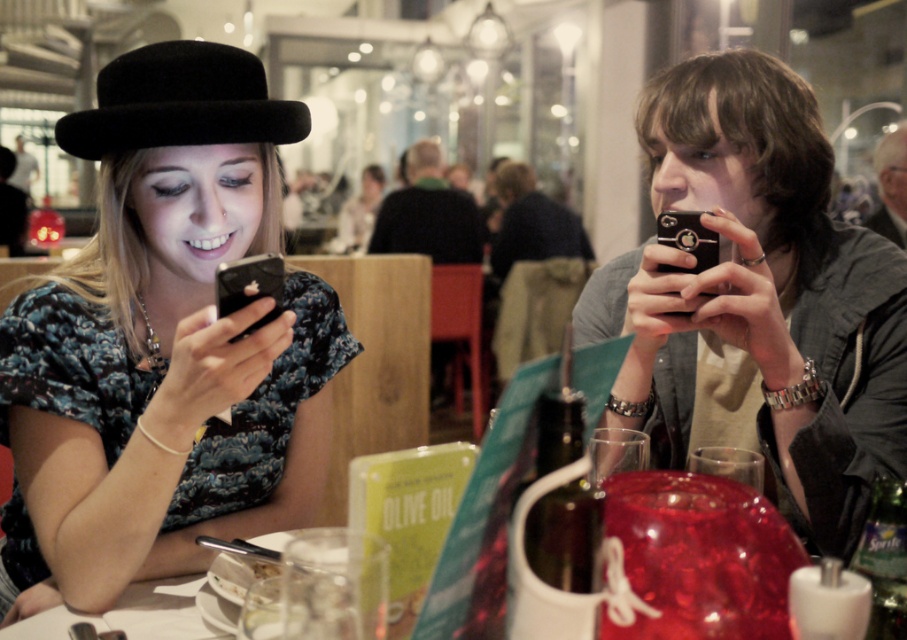
Looking at this image, is matte black hat at upper left shorter than black matte phone at right?

No, matte black hat at upper left is not shorter than black matte phone at right.

Looking at this image, does matte black hat at upper left have a larger size compared to black matte phone at right?

Yes.

Is point (96, 118) positioned behind point (857, 451)?

No, (96, 118) is closer to viewer.

You are a GUI agent. You are given a task and a screenshot of the screen. Output one action in this format:
    pyautogui.click(x=<x>, y=<y>)
    Task: Click on the matte black hat at upper left
    This screenshot has width=907, height=640.
    Given the screenshot: What is the action you would take?
    pyautogui.click(x=163, y=344)

Is black felt fedora at upper left positioned in front of black matte smartphone at left?

No, it is not.

Is black felt fedora at upper left bigger than black matte smartphone at left?

Yes.

What are the coordinates of `black felt fedora at upper left` in the screenshot? It's located at (180, 102).

Find the location of a particular element. black felt fedora at upper left is located at coordinates (180, 102).

Who is lower down, matte black hat at upper left or black felt fedora at upper left?

matte black hat at upper left is lower down.

Looking at this image, does matte black hat at upper left appear on the left side of black felt fedora at upper left?

Incorrect, matte black hat at upper left is not on the left side of black felt fedora at upper left.

This screenshot has width=907, height=640. Identify the location of matte black hat at upper left. (163, 344).